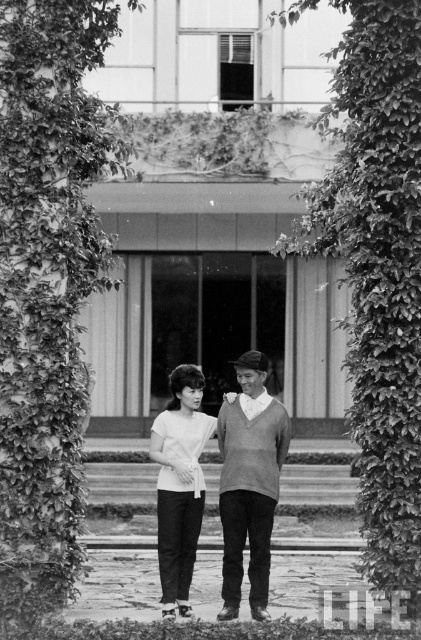
Consider the image. Does green leafy ivy at left have a lesser height compared to white matte shirt at center?

No, green leafy ivy at left is not shorter than white matte shirt at center.

Which is more to the left, green leafy ivy at left or white matte shirt at center?

green leafy ivy at left is more to the left.

Which is in front, point (71, 61) or point (173, 381)?

Point (71, 61) is in front.

Identify the location of green leafy ivy at left. The image size is (421, 640). (47, 285).

Can you confirm if green leafy ivy at left is bigger than sweater-knit sweater at center?

Indeed, green leafy ivy at left has a larger size compared to sweater-knit sweater at center.

Is green leafy ivy at left to the left of sweater-knit sweater at center from the viewer's perspective?

Correct, you'll find green leafy ivy at left to the left of sweater-knit sweater at center.

Where is `green leafy ivy at left`? green leafy ivy at left is located at coordinates (47, 285).

Is point (135, 1) more distant than point (386, 44)?

Yes, it is.

Is point (34, 570) closer to viewer compared to point (412, 45)?

No, it is behind (412, 45).

Where is `green leafy ivy at left`? The height and width of the screenshot is (640, 421). green leafy ivy at left is located at coordinates (47, 285).